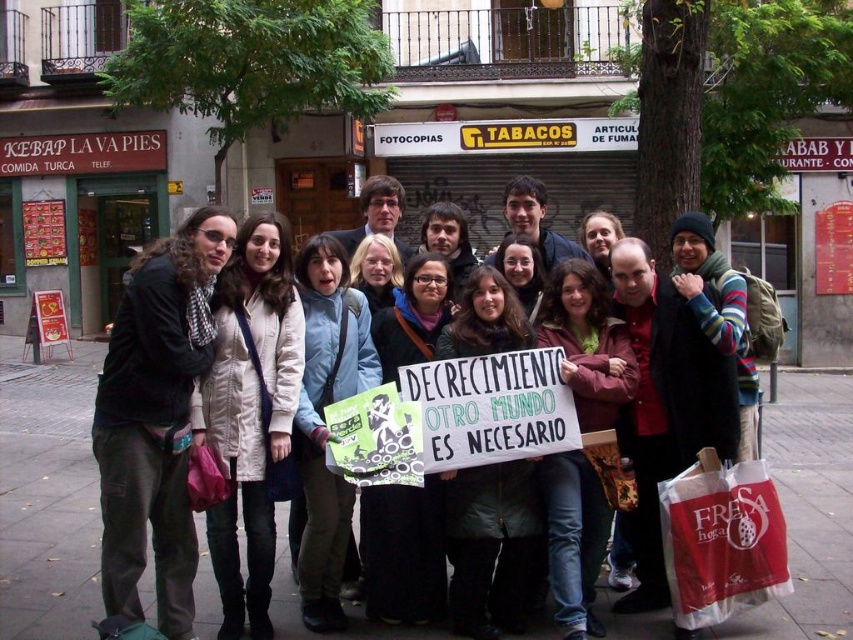
Question: Is matte black jacket at center above red plastic bag at lower right?

Choices:
 (A) yes
 (B) no

Answer: (A)

Question: Which object appears farthest from the camera in this image?

Choices:
 (A) matte black jacket at center
 (B) red plastic bag at lower right

Answer: (B)

Question: Which point is farther to the camera?

Choices:
 (A) red plastic bag at lower right
 (B) matte black jacket at center

Answer: (A)

Question: Can you confirm if matte black jacket at center is positioned to the right of red plastic bag at lower right?

Choices:
 (A) yes
 (B) no

Answer: (B)

Question: Is matte black jacket at center thinner than red plastic bag at lower right?

Choices:
 (A) no
 (B) yes

Answer: (A)